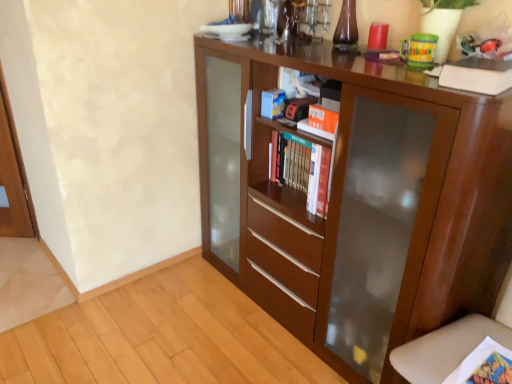
Image resolution: width=512 pixels, height=384 pixels. In order to click on hardcover books at center in this screenshot , I will do (301, 168).

Is the depth of brown wood cupboard at center less than that of white matte book at upper right?

That is True.

Is brown wood cupboard at center positioned with its back to white matte book at upper right?

brown wood cupboard at center is not turned away from white matte book at upper right.

Can you tell me how much brown wood cupboard at center and white matte book at upper right differ in facing direction?

10.9 degrees.

Locate an element on the screen. The width and height of the screenshot is (512, 384). cupboard lying on the left of white matte book at upper right is located at coordinates (357, 202).

Is point (463, 60) in front of point (432, 194)?

That is False.

Does white matte book at upper right have a greater height compared to brown wood cupboard at center?

No.

Does white matte book at upper right lie in front of brown wood cupboard at center?

No.

Can you confirm if hardcover books at center is positioned to the right of brown wood cupboard at center?

No.

Can you tell me how much hardcover books at center and brown wood cupboard at center differ in facing direction?

2.61e-05 degrees.

From the image's perspective, is hardcover books at center located above brown wood cupboard at center?

Yes, from the image's perspective, hardcover books at center is above brown wood cupboard at center.

Can you confirm if hardcover books at center is wider than brown wood cupboard at center?

No, hardcover books at center is not wider than brown wood cupboard at center.

Is hardcover books at center bigger than white matte book at upper right?

Indeed, hardcover books at center has a larger size compared to white matte book at upper right.

In order to click on book below the white matte book at upper right (from a real-world perspective) in this screenshot , I will do `click(301, 168)`.

Does hardcover books at center have a lesser height compared to white matte book at upper right?

In fact, hardcover books at center may be taller than white matte book at upper right.

Is brown wood cupboard at center to the right of hardcover books at center from the viewer's perspective?

Yes, brown wood cupboard at center is to the right of hardcover books at center.

Is brown wood cupboard at center bigger or smaller than hardcover books at center?

Considering their sizes, brown wood cupboard at center takes up more space than hardcover books at center.

From a real-world perspective, is brown wood cupboard at center over hardcover books at center?

No.

How far apart are white matte book at upper right and hardcover books at center?

white matte book at upper right and hardcover books at center are 60.62 centimeters apart from each other.

In terms of width, does white matte book at upper right look wider or thinner when compared to hardcover books at center?

Clearly, white matte book at upper right has more width compared to hardcover books at center.

In the image, there is a hardcover books at center. Where is `paperback book above it (from the image's perspective)`? paperback book above it (from the image's perspective) is located at coordinates (477, 75).

Is white matte book at upper right inside or outside of hardcover books at center?

Result: white matte book at upper right is not inside hardcover books at center, it's outside.

This screenshot has width=512, height=384. Identify the location of cupboard lying below the white matte book at upper right (from the image's perspective). (357, 202).

At what (x,y) coordinates should I click in order to perform the action: click on cupboard on the left of white matte book at upper right. Please return your answer as a coordinate pair (x, y). Looking at the image, I should click on (357, 202).

Which object lies nearer to the anchor point brown wood cupboard at center, hardcover books at center or white matte book at upper right?

hardcover books at center lies closer to brown wood cupboard at center than the other object.

Considering their positions, is white matte book at upper right positioned further to brown wood cupboard at center than hardcover books at center?

Based on the image, white matte book at upper right appears to be further to brown wood cupboard at center.

Estimate the real-world distances between objects in this image. Which object is closer to hardcover books at center, brown wood cupboard at center or white matte book at upper right?

brown wood cupboard at center is closer to hardcover books at center.

Estimate the real-world distances between objects in this image. Which object is further from hardcover books at center, white matte book at upper right or brown wood cupboard at center?

The object further to hardcover books at center is white matte book at upper right.

Estimate the real-world distances between objects in this image. Which object is closer to white matte book at upper right, hardcover books at center or brown wood cupboard at center?

Among the two, hardcover books at center is located nearer to white matte book at upper right.

Estimate the real-world distances between objects in this image. Which object is closer to white matte book at upper right, brown wood cupboard at center or hardcover books at center?

Among the two, hardcover books at center is located nearer to white matte book at upper right.

Image resolution: width=512 pixels, height=384 pixels. I want to click on paperback book located between brown wood cupboard at center and hardcover books at center in the depth direction, so click(477, 75).